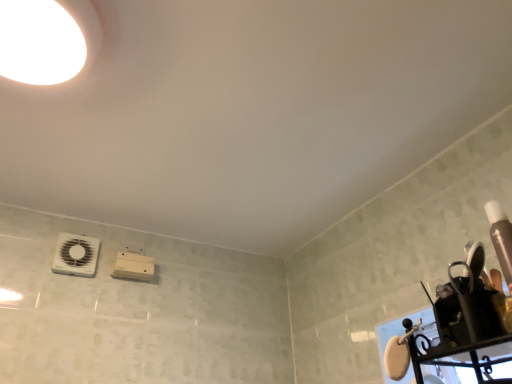
Question: Considering their positions, is white plastic fan at lower left located in front of or behind white glossy droplight at upper left?

Choices:
 (A) front
 (B) behind

Answer: (B)

Question: Do you think white plastic fan at lower left is within white glossy droplight at upper left, or outside of it?

Choices:
 (A) outside
 (B) inside

Answer: (A)

Question: In terms of size, does white plastic fan at lower left appear bigger or smaller than white glossy droplight at upper left?

Choices:
 (A) small
 (B) big

Answer: (A)

Question: In the image, is white glossy droplight at upper left on the left side or the right side of white plastic fan at lower left?

Choices:
 (A) left
 (B) right

Answer: (B)

Question: From their relative heights in the image, would you say white glossy droplight at upper left is taller or shorter than white plastic fan at lower left?

Choices:
 (A) short
 (B) tall

Answer: (A)

Question: Choose the correct answer: Is white glossy droplight at upper left inside white plastic fan at lower left or outside it?

Choices:
 (A) inside
 (B) outside

Answer: (B)

Question: Is point (54, 39) positioned closer to the camera than point (60, 251)?

Choices:
 (A) farther
 (B) closer

Answer: (B)